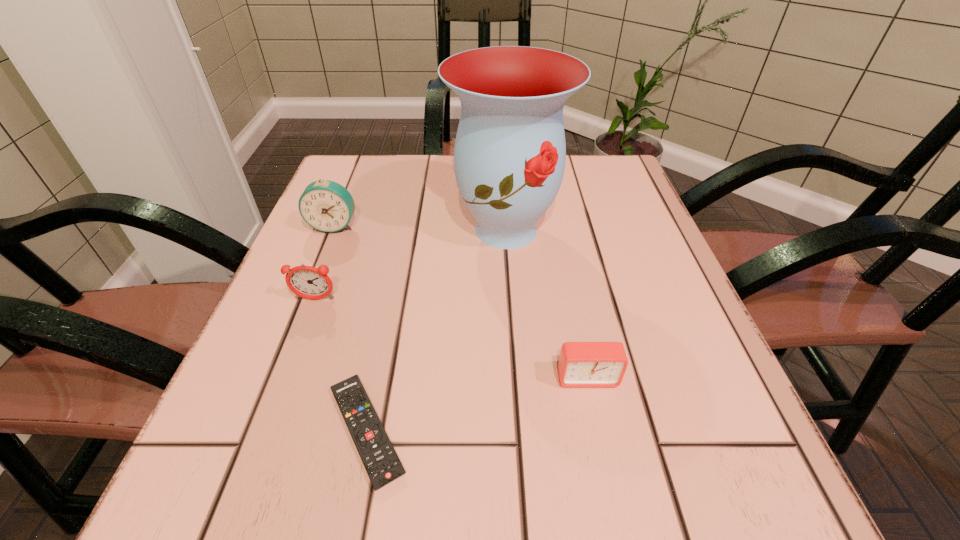
Locate an element on the screen. The image size is (960, 540). vase is located at coordinates click(509, 158).

Locate an element on the screen. Image resolution: width=960 pixels, height=540 pixels. the tallest alarm clock is located at coordinates (325, 205).

This screenshot has width=960, height=540. Find the location of `the farthest alarm clock`. the farthest alarm clock is located at coordinates (325, 205).

Locate an element on the screen. This screenshot has width=960, height=540. the second nearest alarm clock is located at coordinates (308, 282).

The image size is (960, 540). What are the coordinates of `the second shortest alarm clock` in the screenshot? It's located at (308, 282).

At what (x,y) coordinates should I click in order to perform the action: click on the nearest alarm clock. Please return your answer as a coordinate pair (x, y). This screenshot has width=960, height=540. Looking at the image, I should click on (581, 364).

What are the coordinates of `the second shortest object` in the screenshot? It's located at (581, 364).

You are a GUI agent. You are given a task and a screenshot of the screen. Output one action in this format:
    pyautogui.click(x=<x>, y=<y>)
    Task: Click on the remote control
    This screenshot has width=960, height=540.
    Given the screenshot: What is the action you would take?
    pyautogui.click(x=382, y=464)

This screenshot has width=960, height=540. I want to click on the third object from right to left, so click(x=382, y=464).

Where is `vacant space located 0.280m on the left of the vase`? vacant space located 0.280m on the left of the vase is located at coordinates (314, 230).